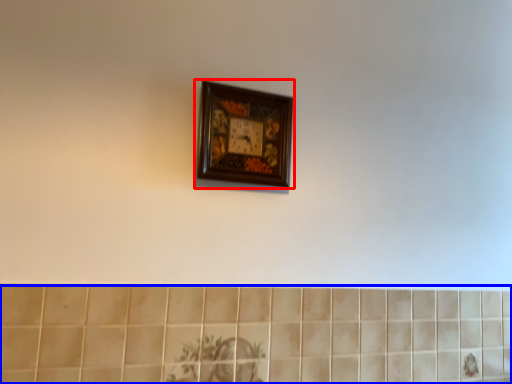
Question: Which object is further to the camera taking this photo, picture frame (highlighted by a red box) or ceramic tile (highlighted by a blue box)?

Choices:
 (A) picture frame
 (B) ceramic tile

Answer: (A)